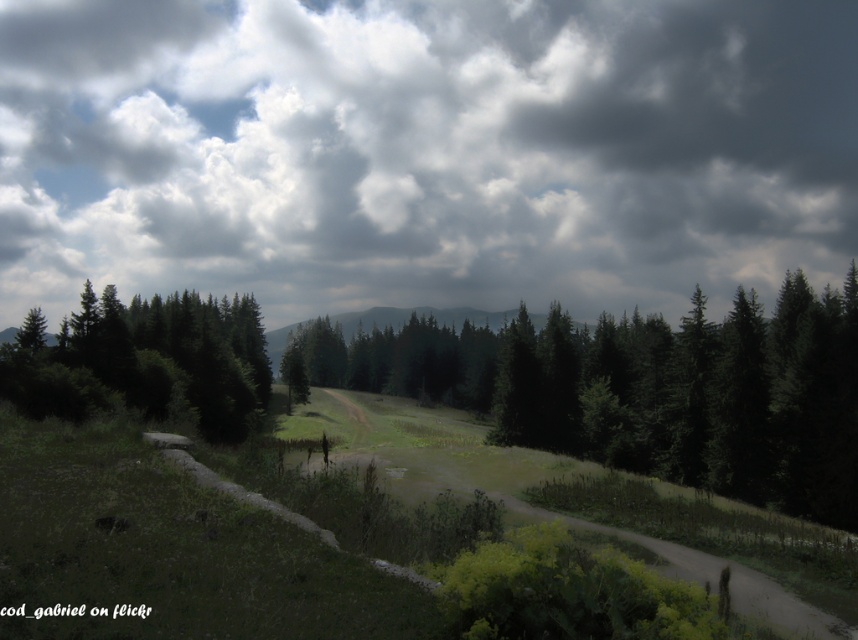
Question: Considering the real-world distances, which object is closest to the green matte trees at center?

Choices:
 (A) green matte tree at center
 (B) cloudy sky at upper center

Answer: (A)

Question: Observing the image, what is the correct spatial positioning of cloudy sky at upper center in reference to green matte tree at center?

Choices:
 (A) above
 (B) below

Answer: (A)

Question: Which point is closer to the camera?

Choices:
 (A) green matte trees at center
 (B) green matte tree at center
 (C) cloudy sky at upper center

Answer: (A)

Question: Is cloudy sky at upper center closer to the viewer compared to green matte tree at center?

Choices:
 (A) yes
 (B) no

Answer: (B)

Question: Which is farther from the green matte trees at center?

Choices:
 (A) green matte tree at center
 (B) cloudy sky at upper center

Answer: (B)

Question: Does green matte tree at center appear under green matte trees at center?

Choices:
 (A) yes
 (B) no

Answer: (A)